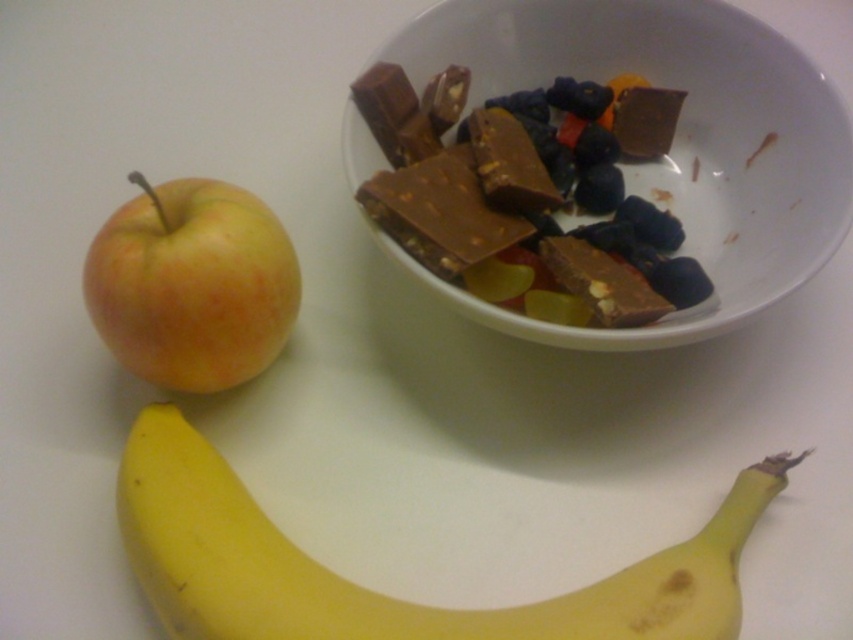
Question: Does white ceramic bowl at upper center come behind yellow matte apple at left?

Choices:
 (A) yes
 (B) no

Answer: (A)

Question: Which object is positioned closest to the yellow matte apple at left?

Choices:
 (A) yellow smooth banana at lower left
 (B) matte brown chocolate bar at upper center
 (C) dark chocolate bar at upper center
 (D) white ceramic bowl at upper center

Answer: (A)

Question: Does white ceramic bowl at upper center appear under matte brown chocolate bar at upper center?

Choices:
 (A) no
 (B) yes

Answer: (B)

Question: Which of the following is the closest to the observer?

Choices:
 (A) dark chocolate bar at center
 (B) matte brown chocolate bar at upper center
 (C) white ceramic bowl at upper center
 (D) yellow smooth banana at lower left

Answer: (D)

Question: Which of the following is the farthest from the observer?

Choices:
 (A) (517, 147)
 (B) (787, 180)
 (C) (184, 182)

Answer: (B)

Question: Does dark chocolate bar at center have a smaller size compared to matte brown chocolate bar at upper center?

Choices:
 (A) yes
 (B) no

Answer: (B)